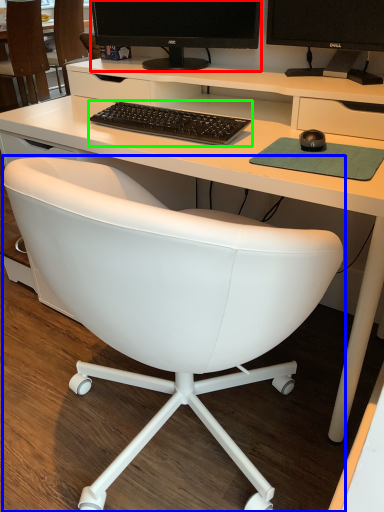
Question: Considering the real-world distances, which object is closest to computer monitor (highlighted by a red box)? chair (highlighted by a blue box) or computer keyboard (highlighted by a green box).

Choices:
 (A) chair
 (B) computer keyboard

Answer: (B)